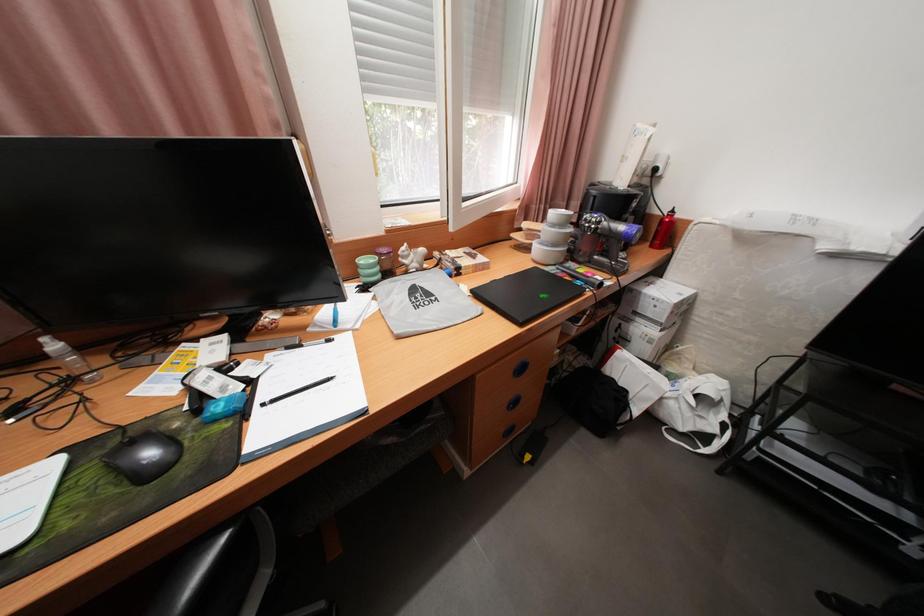
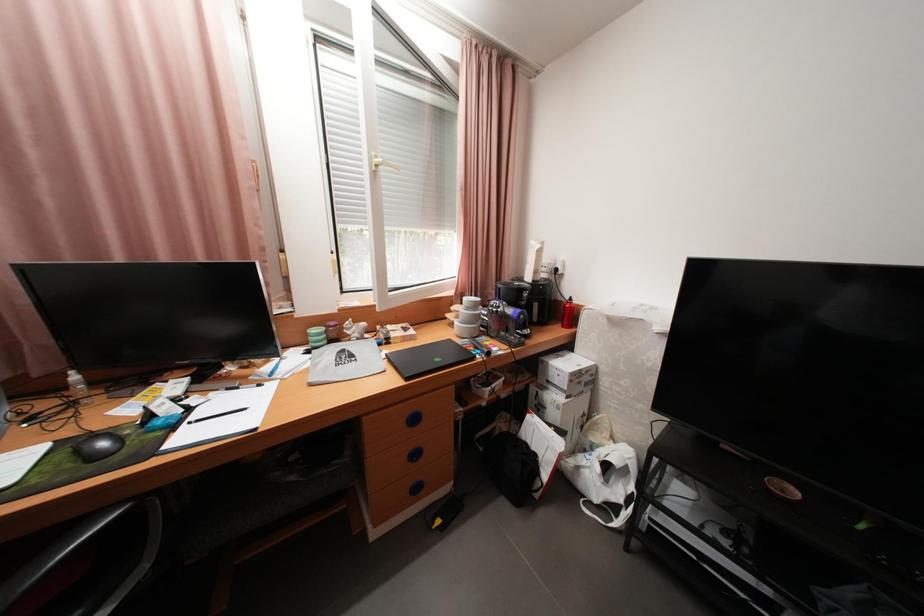
Which direction would the cameraman need to move to produce the second image?

The cameraman walked toward right, backward.